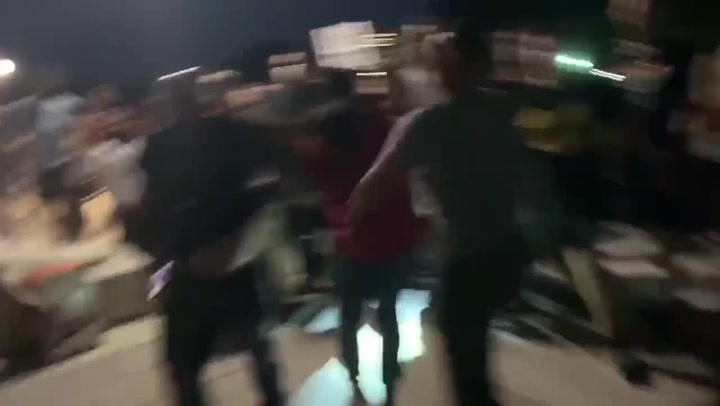
This screenshot has width=720, height=406. In order to click on floor in this screenshot , I will do point(114,380), point(566,394).